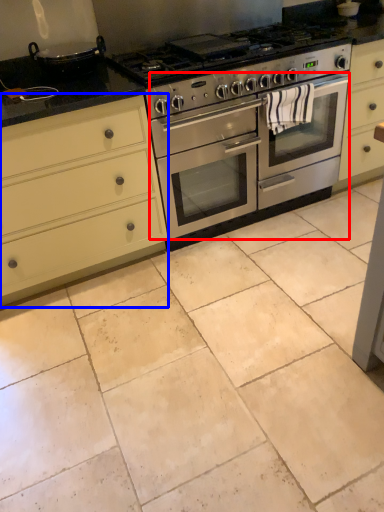
Question: Which point is further to the camera, oven (highlighted by a red box) or cabinetry (highlighted by a blue box)?

Choices:
 (A) oven
 (B) cabinetry

Answer: (A)